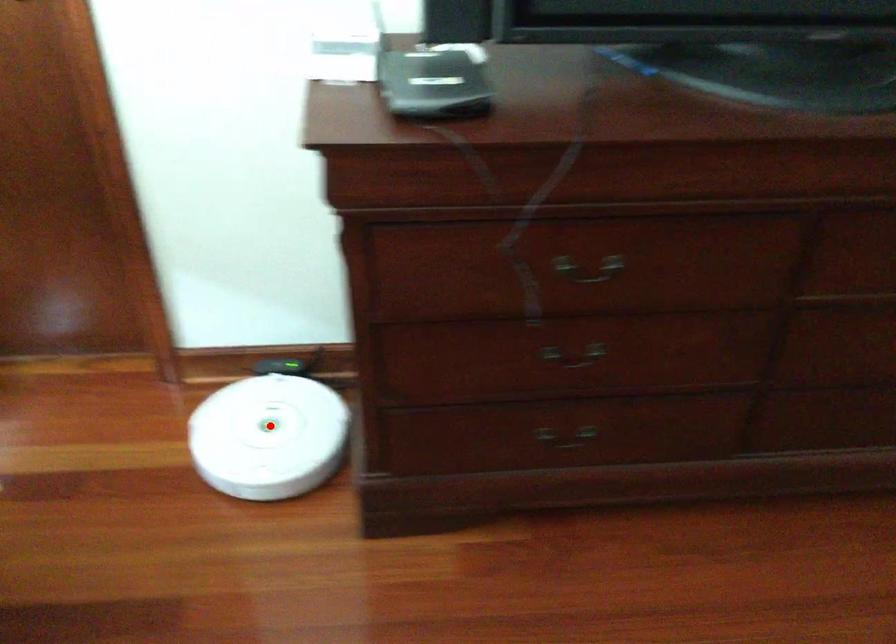
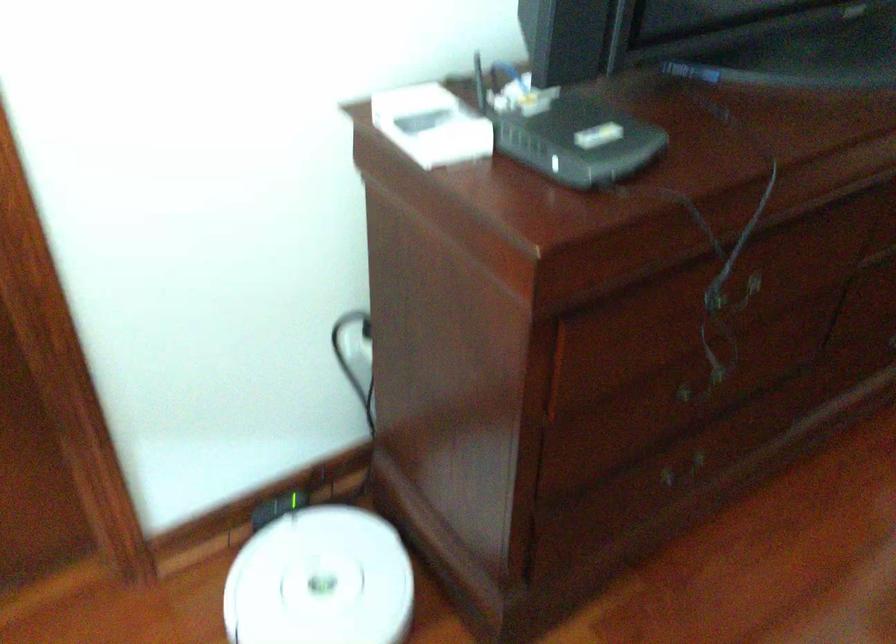
Find the pixel in the second image that matches the highlighted location in the first image.

(321, 581)